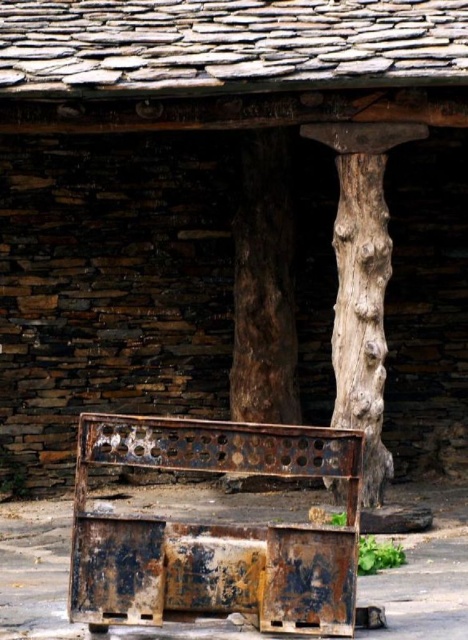
Can you confirm if brown rough tree trunk at center is shorter than rough bark tree trunk at center?

Yes, brown rough tree trunk at center is shorter than rough bark tree trunk at center.

Who is positioned more to the right, brown rough tree trunk at center or rough bark tree trunk at center?

rough bark tree trunk at center

At what (x,y) coordinates should I click in order to perform the action: click on brown rough tree trunk at center. Please return your answer as a coordinate pair (x, y). The height and width of the screenshot is (640, 468). Looking at the image, I should click on (263, 284).

Where is `brown rough tree trunk at center`? The height and width of the screenshot is (640, 468). brown rough tree trunk at center is located at coordinates (263, 284).

Locate an element on the screen. rusty metal bench at center is located at coordinates [213, 531].

Who is higher up, rusty metal bench at center or brown rough tree trunk at center?

Positioned higher is brown rough tree trunk at center.

Is point (308, 598) more distant than point (239, 282)?

That is False.

I want to click on rusty metal bench at center, so click(x=213, y=531).

Does point (153, 612) come in front of point (351, 342)?

That is True.

Who is positioned more to the left, rusty metal bench at center or rough bark tree trunk at center?

rusty metal bench at center

Is point (243, 531) behind point (368, 428)?

No, it is in front of (368, 428).

Locate an element on the screen. rusty metal bench at center is located at coordinates (213, 531).